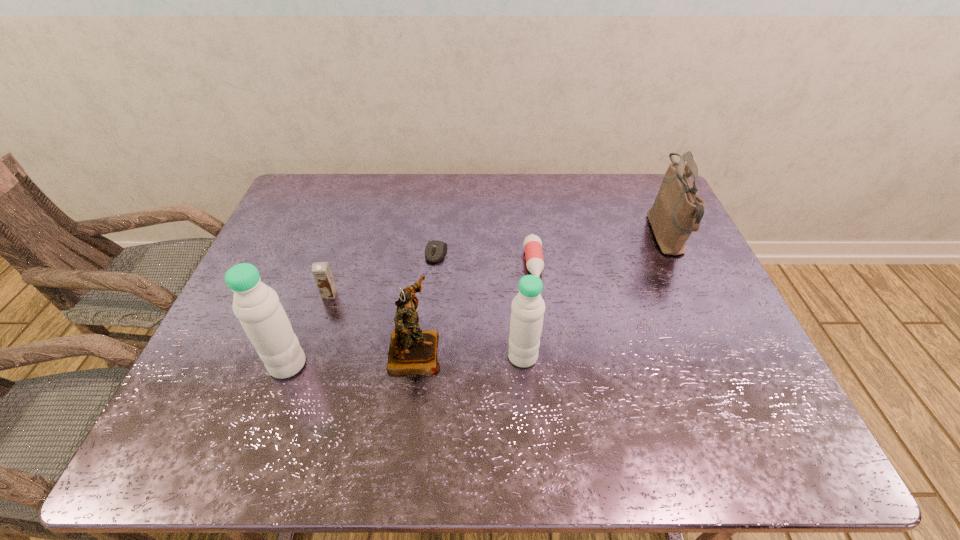
Identify which object is the sixth nearest to the computer equipment. Please provide its 2D coordinates. Your answer should be formatted as a tuple, i.e. [(x, y)], where the tuple contains the x and y coordinates of a point satisfying the conditions above.

[(677, 211)]

Where is `free region that satisfies the following two spatial constraints: 1. with the cap open on the second shortest object; 2. on the front-facing side of the figurine`? free region that satisfies the following two spatial constraints: 1. with the cap open on the second shortest object; 2. on the front-facing side of the figurine is located at coordinates click(x=544, y=351).

This screenshot has height=540, width=960. What are the coordinates of `free spot that satisfies the following two spatial constraints: 1. on the front-facing side of the figurine; 2. on the front side of the left water bottle` in the screenshot? It's located at (413, 364).

Locate an element on the screen. The width and height of the screenshot is (960, 540). free region that satisfies the following two spatial constraints: 1. on the front-facing side of the shoulder bag; 2. on the front side of the shorter water bottle is located at coordinates (722, 356).

The width and height of the screenshot is (960, 540). In order to click on vacant region that satisfies the following two spatial constraints: 1. on the front-facing side of the right water bottle; 2. on the left side of the figurine in this screenshot , I will do `click(415, 356)`.